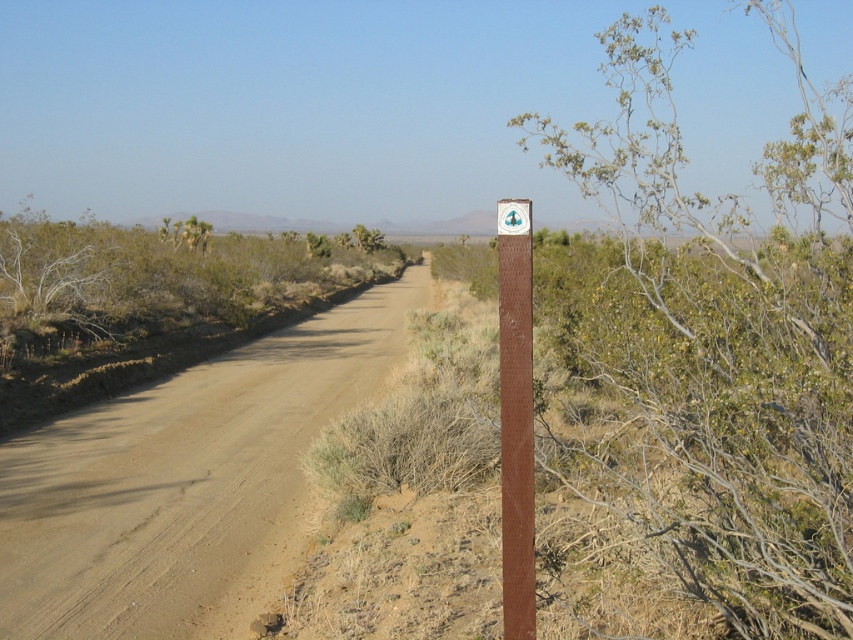
In the scene shown: Can you confirm if brown wooden post at center is thinner than white plastic sign at center?

Yes.

Is point (503, 268) positioned before point (521, 230)?

No.

Who is more forward, (531, 243) or (497, 209)?

Point (497, 209) is in front.

The image size is (853, 640). I want to click on brown wooden post at center, so click(x=515, y=417).

Does brown sandy dirt track at center come in front of brown wooden post at center?

No, it is not.

Does brown sandy dirt track at center have a greater height compared to brown wooden post at center?

Yes.

Find the location of a particular element. This screenshot has height=640, width=853. brown sandy dirt track at center is located at coordinates (180, 476).

What do you see at coordinates (180, 476) in the screenshot? The height and width of the screenshot is (640, 853). I see `brown sandy dirt track at center` at bounding box center [180, 476].

The image size is (853, 640). What do you see at coordinates (180, 476) in the screenshot? I see `brown sandy dirt track at center` at bounding box center [180, 476].

Find the location of a particular element. This screenshot has height=640, width=853. brown sandy dirt track at center is located at coordinates (180, 476).